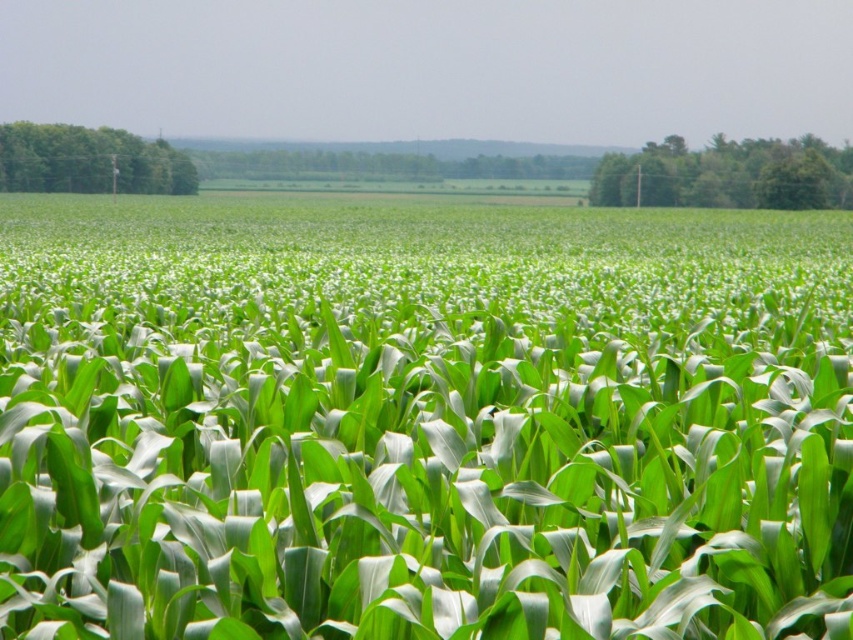
Is point (312, 342) in front of point (648, 170)?

Yes, point (312, 342) is closer to viewer.

Who is shorter, green leafy corn at center or green leafy tree at upper right?

green leafy corn at center is shorter.

Is point (757, 410) positioned after point (666, 161)?

No, it is not.

Where is `green leafy corn at center`? green leafy corn at center is located at coordinates (422, 420).

Does green leafy corn at center appear on the right side of green leafy tree at left?

Yes, green leafy corn at center is to the right of green leafy tree at left.

The height and width of the screenshot is (640, 853). What do you see at coordinates (422, 420) in the screenshot? I see `green leafy corn at center` at bounding box center [422, 420].

Does point (47, 596) come closer to viewer compared to point (129, 150)?

Yes, it is.

I want to click on green leafy corn at center, so click(x=422, y=420).

Is green leafy tree at upper right further to the viewer compared to green leafy tree at left?

Yes, green leafy tree at upper right is further from the viewer.

Locate an element on the screen. The width and height of the screenshot is (853, 640). green leafy tree at upper right is located at coordinates (727, 173).

Is point (647, 180) more distant than point (140, 182)?

No.

Find the location of `green leafy tree at upper right`. green leafy tree at upper right is located at coordinates (727, 173).